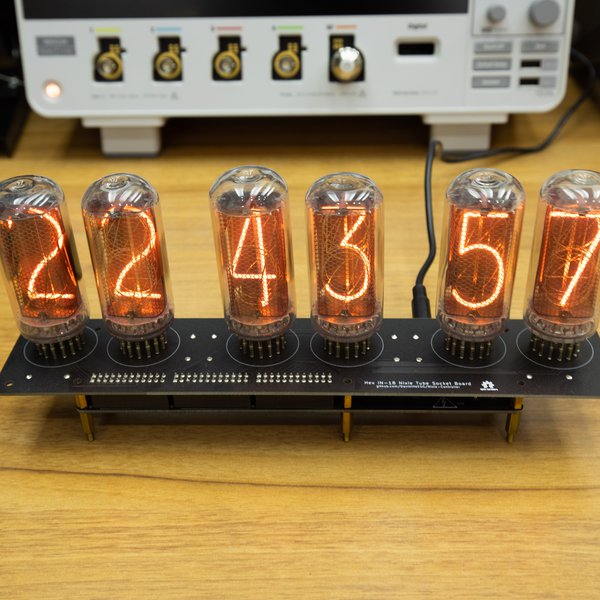
Identify the location of black cord. (429, 177).